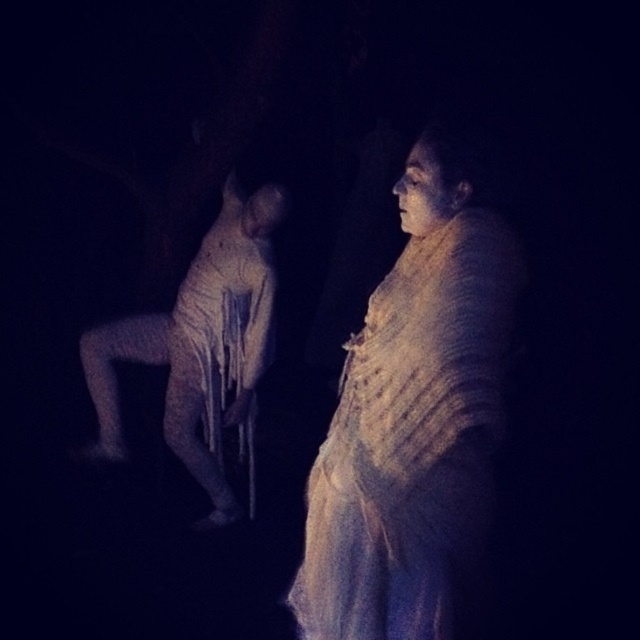
You are a delivery robot with a width of 1 meter. You need to navigate through the space between the white textured dress at center and the white textured crutches at left. Can you fit through this space?

The distance between the white textured dress at center and the white textured crutches at left is 1.47 meters. Since the robot is 1 meter wide, it can fit through the space as the distance is wider than the robot.

You are standing in a dark room and want to reach a point that is 6.79 feet away from your current position. If you move straight ahead, will you reach the point labeled as point (365,580)?

Yes, since the point (365,580) is 6.79 feet away from the camera, moving straight ahead will reach it.